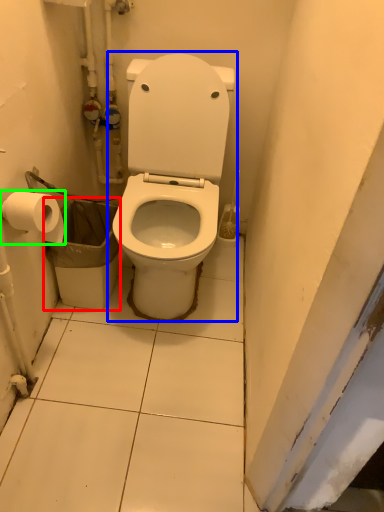
Question: Which object is positioned closest to garbage (highlighted by a red box)? Select from toilet (highlighted by a blue box) and toilet paper (highlighted by a green box).

Choices:
 (A) toilet
 (B) toilet paper

Answer: (A)